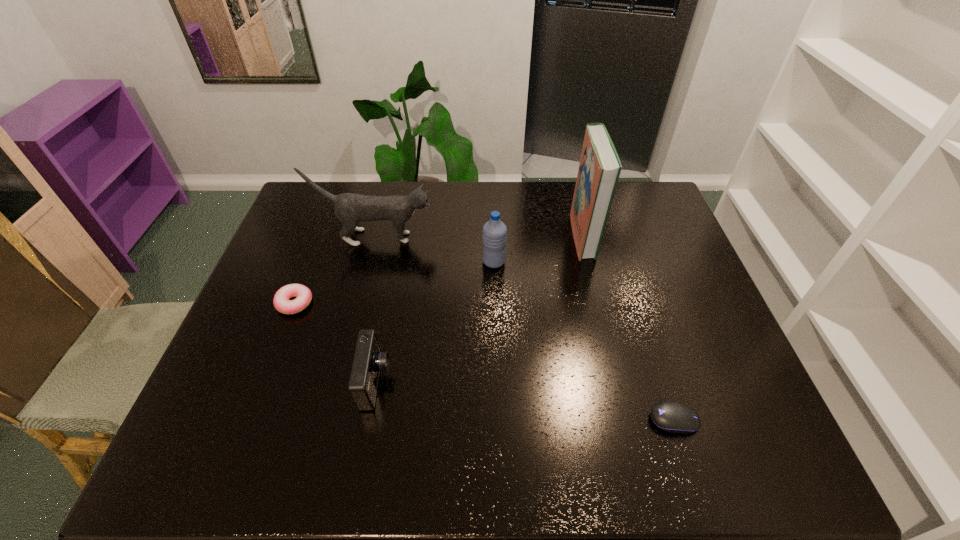
Image resolution: width=960 pixels, height=540 pixels. Find the location of `free spot located on the cover of the hardback book`. free spot located on the cover of the hardback book is located at coordinates (498, 236).

The height and width of the screenshot is (540, 960). Find the location of `vacant space located at the face of the cat`. vacant space located at the face of the cat is located at coordinates click(538, 238).

Find the location of `blank area located 0.140m on the front of the water bottle`. blank area located 0.140m on the front of the water bottle is located at coordinates (495, 306).

Where is `vacant region located 0.200m on the front-facing side of the camera`? The height and width of the screenshot is (540, 960). vacant region located 0.200m on the front-facing side of the camera is located at coordinates (475, 381).

Locate an element on the screen. The image size is (960, 540). vacant space situated 0.140m on the front of the doughnut is located at coordinates (272, 362).

The width and height of the screenshot is (960, 540). Find the location of `blank space located on the back of the computer mouse`. blank space located on the back of the computer mouse is located at coordinates (646, 334).

This screenshot has height=540, width=960. I want to click on object that is at the far edge, so click(600, 167).

Locate an element on the screen. This screenshot has width=960, height=540. object positioned at the near edge is located at coordinates (673, 417).

The height and width of the screenshot is (540, 960). In order to click on cat positioned at the left edge in this screenshot , I will do `click(350, 208)`.

At what (x,y) coordinates should I click in order to perform the action: click on doughnut that is positioned at the left edge. Please return your answer as a coordinate pair (x, y). This screenshot has height=540, width=960. Looking at the image, I should click on (282, 303).